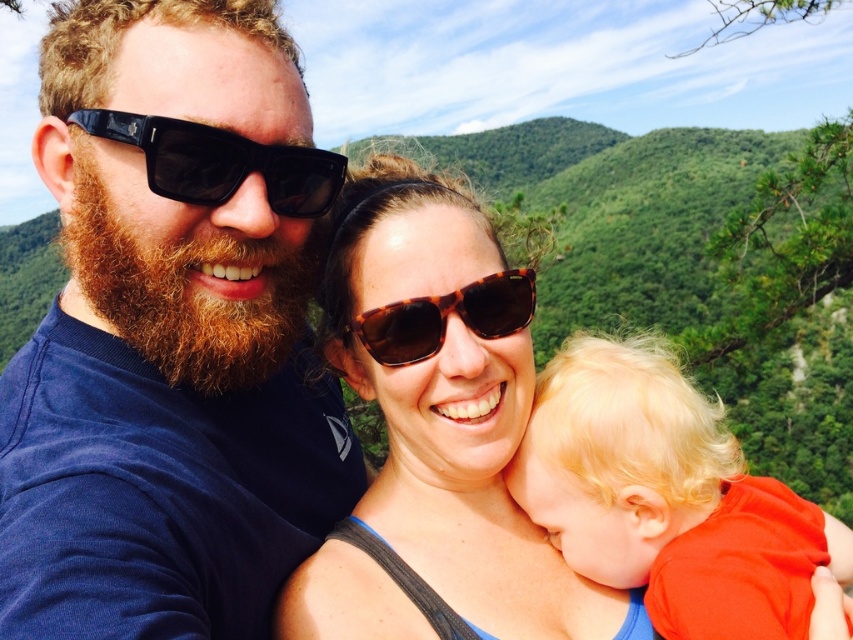
Is point (283, 202) positioned behind point (381, 355)?

No.

The width and height of the screenshot is (853, 640). What do you see at coordinates (219, 161) in the screenshot?
I see `black plastic sunglasses at left` at bounding box center [219, 161].

Locate an element on the screen. The width and height of the screenshot is (853, 640). black plastic sunglasses at left is located at coordinates (219, 161).

Is blonde hair at center closer to camera compared to black plastic sunglasses at left?

Yes.

Who is more distant from viewer, (x=669, y=400) or (x=140, y=132)?

The point (x=669, y=400) is behind.

The image size is (853, 640). I want to click on blonde hair at center, so click(x=660, y=493).

Who is positioned more to the right, matte black sunglasses at left or reddish-brown fuzzy beard at left?

Positioned to the right is matte black sunglasses at left.

Is point (241, 605) positioned behind point (212, 368)?

No, it is in front of (212, 368).

Where is `matte black sunglasses at left`? This screenshot has height=640, width=853. matte black sunglasses at left is located at coordinates (171, 333).